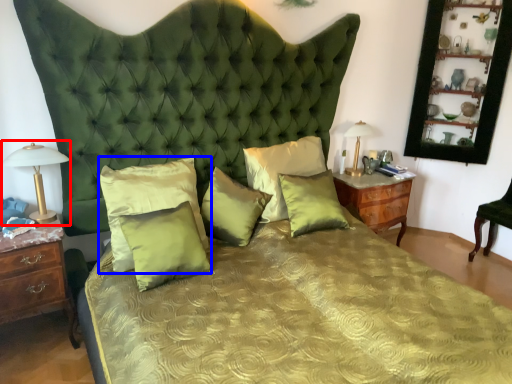
Question: Which of the following is the closest to the observer, bedside lamp (highlighted by a red box) or pillow (highlighted by a blue box)?

Choices:
 (A) bedside lamp
 (B) pillow

Answer: (A)